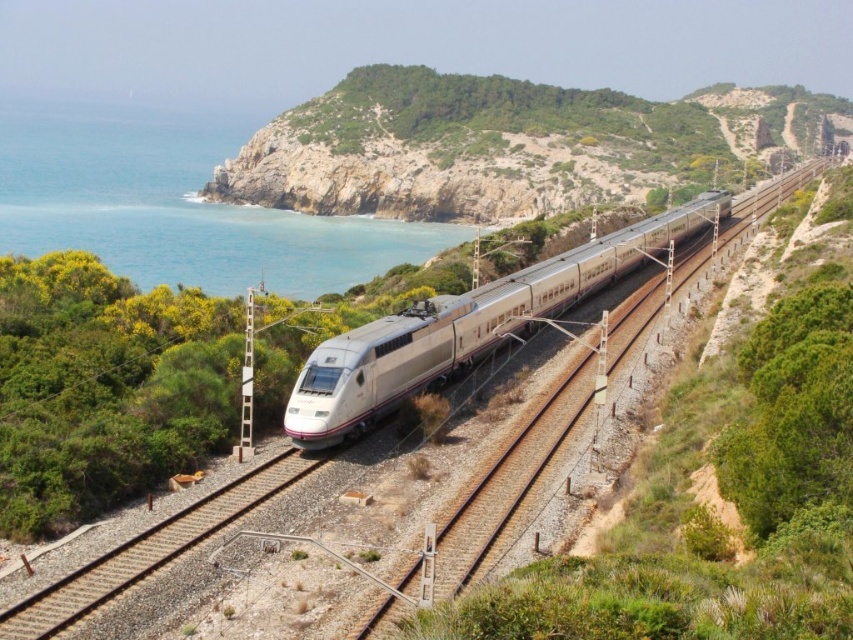
You are a passenger on the high speed train and looking out the window. You see a green grassy hillside at center and blue water at left. Which of these two objects has a wider visual presence in the scene?

The blue water at left has a wider visual presence than the green grassy hillside at center, since the green grassy hillside at center has a lesser width compared to blue water at left.